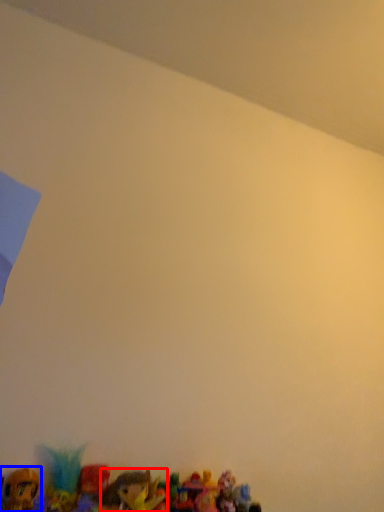
Question: Which object is further to the camera taking this photo, toy (highlighted by a red box) or toy (highlighted by a blue box)?

Choices:
 (A) toy
 (B) toy

Answer: (B)